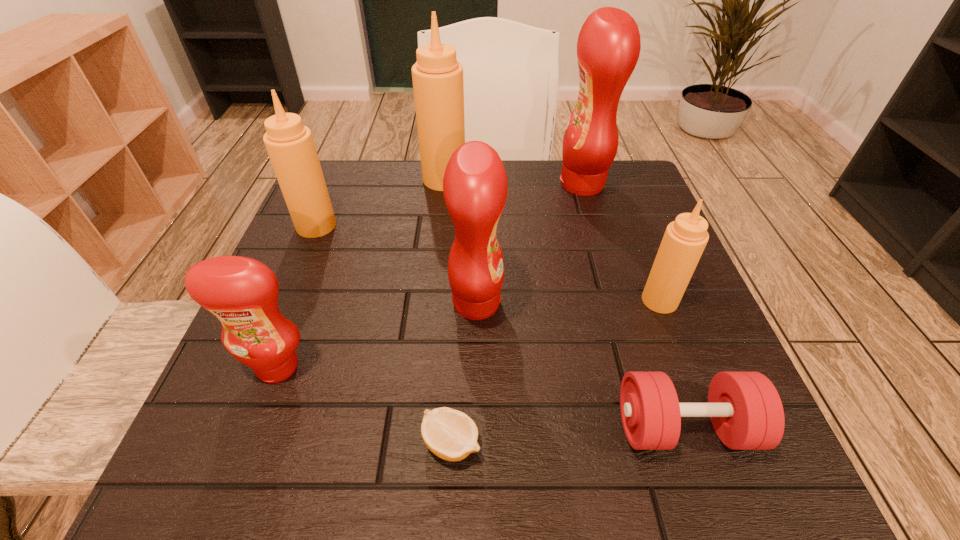
The image size is (960, 540). What are the coordinates of `object present at the near right corner` in the screenshot? It's located at pyautogui.click(x=746, y=411).

The width and height of the screenshot is (960, 540). In the image, there is a desktop. What are the coordinates of `vacant space at the far edge` in the screenshot? It's located at coord(410,190).

In the image, there is a desktop. Where is `blank space at the near edge`? The height and width of the screenshot is (540, 960). blank space at the near edge is located at coordinates (657, 468).

Image resolution: width=960 pixels, height=540 pixels. In the image, there is a desktop. In order to click on vacant space at the left edge in this screenshot , I will do `click(280, 307)`.

At what (x,y) coordinates should I click in order to perform the action: click on vacant space at the right edge of the desktop. Please return your answer as a coordinate pair (x, y). Image resolution: width=960 pixels, height=540 pixels. Looking at the image, I should click on (680, 397).

At what (x,y) coordinates should I click in order to perform the action: click on vacant region at the far left corner of the desktop. Please return your answer as a coordinate pair (x, y). The image size is (960, 540). Looking at the image, I should click on (371, 190).

The image size is (960, 540). Identify the location of free space at the near left corner. (311, 436).

Locate an element on the screen. vacant space at the far right corner is located at coordinates (615, 186).

The width and height of the screenshot is (960, 540). Identify the location of vacant point located between the lemon and the biggest tan condiment. 448,311.

Identify the location of vacant area between the nearest condiment and the lemon. (365, 405).